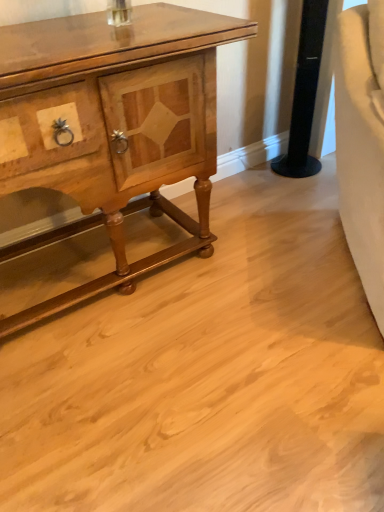
This screenshot has width=384, height=512. In order to click on vacant area that lies between wooden polished cabinet at left and black glossy speaker at upper right in this screenshot , I will do `click(252, 201)`.